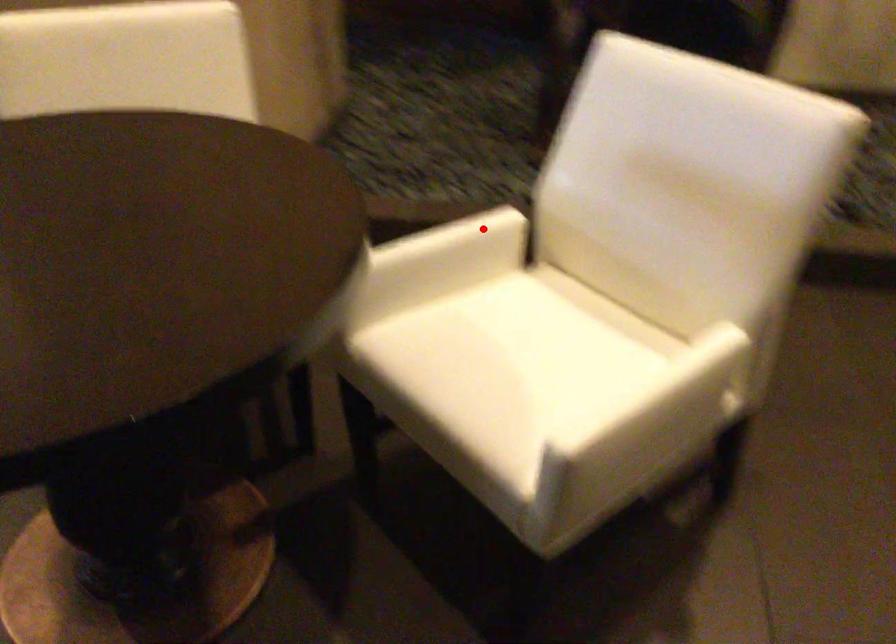
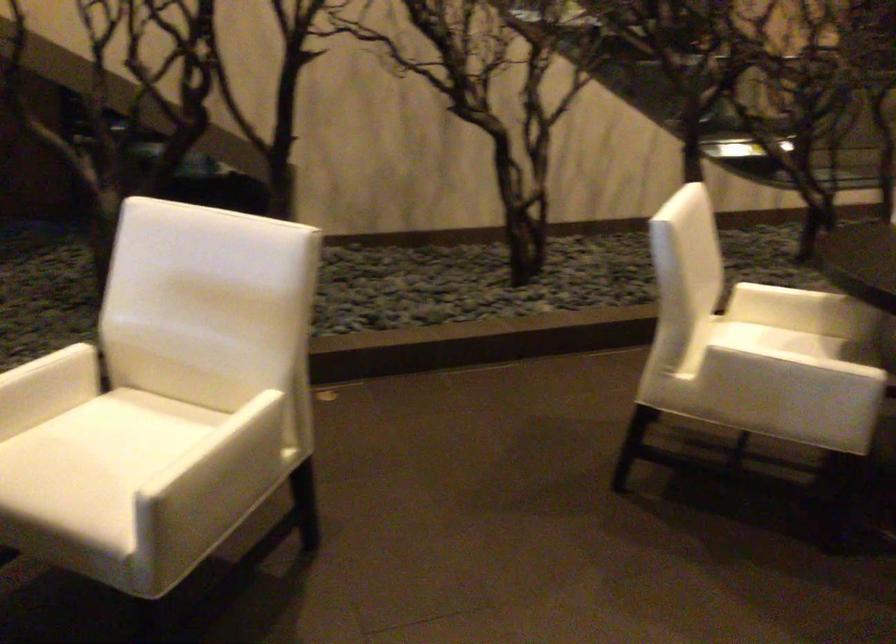
Where in the second image is the point corresponding to the highlighted location from the first image?

(58, 362)